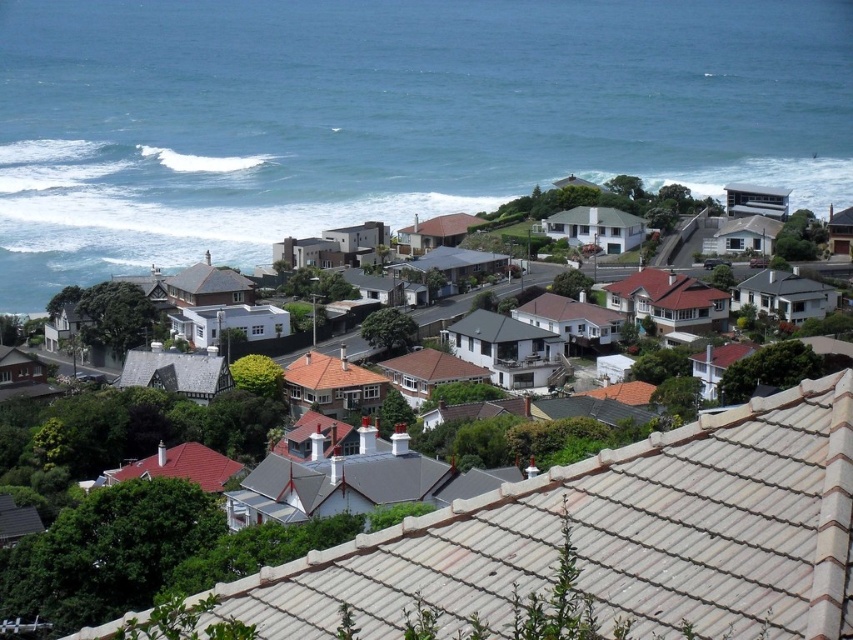
Between blue water at center and white tile houses at center, which one has more height?

blue water at center is taller.

Between blue water at center and white tile houses at center, which one appears on the left side from the viewer's perspective?

white tile houses at center

Who is more forward, (105, 262) or (402, 573)?

Positioned in front is point (402, 573).

The width and height of the screenshot is (853, 640). In order to click on blue water at center in this screenshot , I will do `click(386, 115)`.